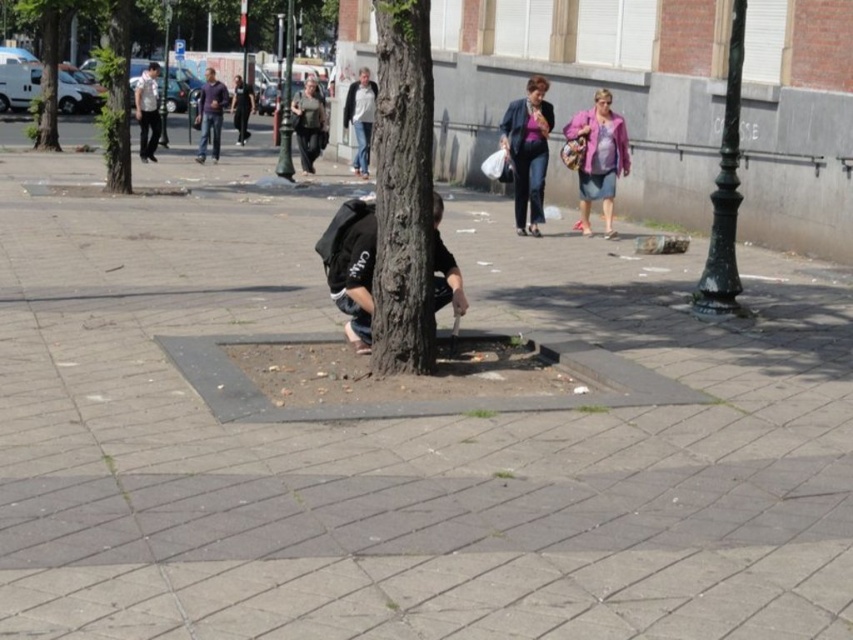
Which is behind, point (537, 182) or point (149, 156)?

Positioned behind is point (149, 156).

How far apart are purple matte jacket at upper right and dark gray jacket at upper left?

A distance of 11.32 meters exists between purple matte jacket at upper right and dark gray jacket at upper left.

This screenshot has height=640, width=853. I want to click on purple matte jacket at upper right, so click(527, 150).

Is point (349, 208) closer to camera compared to point (47, 16)?

Yes, it is.

From the picture: Is black matte jacket at center behind smooth bark tree at upper left?

No, it is not.

The width and height of the screenshot is (853, 640). Describe the element at coordinates (351, 266) in the screenshot. I see `black matte jacket at center` at that location.

Locate an element on the screen. This screenshot has width=853, height=640. black matte jacket at center is located at coordinates (351, 266).

Does smooth bark tree at upper left come in front of dark gray sweater at center?

No, it is not.

Who is more forward, [44,76] or [299,106]?

Point [299,106] is in front.

Identify the location of smooth bark tree at upper left. This screenshot has height=640, width=853. (47, 61).